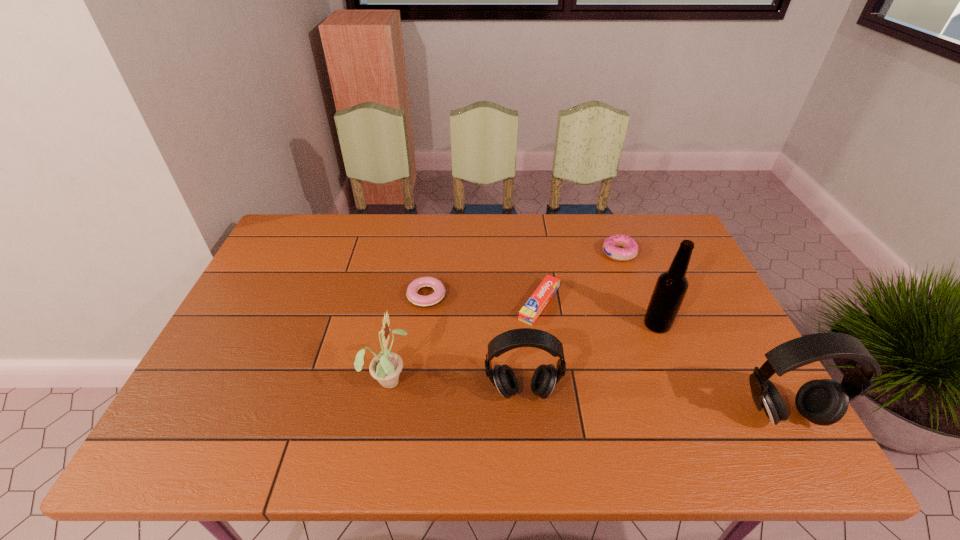
Find the location of a particular element. The width and height of the screenshot is (960, 540). free spot between the left earphone and the sunflower is located at coordinates (455, 385).

Identify the location of vacant area that lies between the toothpaste and the left doughnut. This screenshot has width=960, height=540. (483, 300).

Find the location of `vacant area that lies between the taller earphone and the right doughnut`. vacant area that lies between the taller earphone and the right doughnut is located at coordinates (701, 334).

Where is `free space between the toothpaste and the rightmost object`? The width and height of the screenshot is (960, 540). free space between the toothpaste and the rightmost object is located at coordinates (660, 359).

Locate an element on the screen. The image size is (960, 540). vacant space that is in between the taller earphone and the nearer doughnut is located at coordinates (604, 355).

Find the location of a particular element. The width and height of the screenshot is (960, 540). free space between the nearer doughnut and the right earphone is located at coordinates (604, 355).

Image resolution: width=960 pixels, height=540 pixels. I want to click on free space between the left earphone and the right earphone, so click(x=652, y=403).

Locate an element on the screen. The width and height of the screenshot is (960, 540). object that ranks as the fourth closest to the sunflower is located at coordinates (670, 289).

The width and height of the screenshot is (960, 540). What are the coordinates of `object that can be found as the third closest to the left earphone` in the screenshot? It's located at (433, 299).

Locate an element on the screen. This screenshot has width=960, height=540. vacant area in the image that satisfies the following two spatial constraints: 1. on the front side of the fifth tallest object; 2. on the front-facing side of the sunflower is located at coordinates (666, 379).